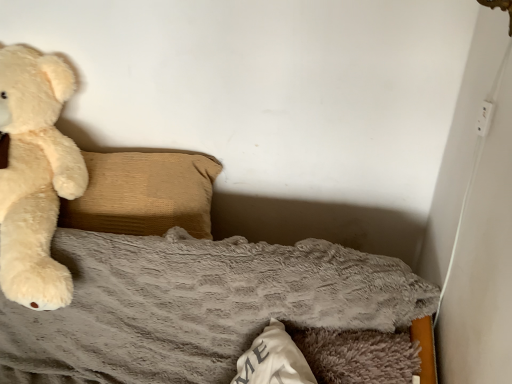
Question: Should I look upward or downward to see beige textured pillow at left?

Choices:
 (A) up
 (B) down

Answer: (B)